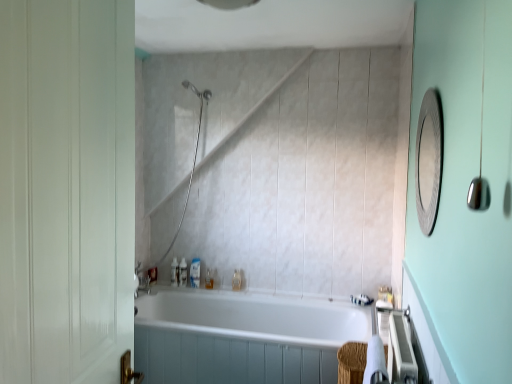
Question: Would you say translucent plastic bottle at lower left, arranged as the seventh toiletry when viewed from the right, is to the left or to the right of translucent plastic bottle at lower center, which is the sixth toiletry in left-to-right order, in the picture?

Choices:
 (A) right
 (B) left

Answer: (B)

Question: Based on their sizes in the image, would you say translucent plastic bottle at lower left, which is counted as the first toiletry, starting from the left, is bigger or smaller than translucent plastic bottle at lower center, which is the sixth toiletry in left-to-right order?

Choices:
 (A) small
 (B) big

Answer: (A)

Question: Considering the real-world distances, which object is closest to the metallic textured mirror at upper right?

Choices:
 (A) translucent plastic soap dispenser at center, the 4th toiletry positioned from the right
 (B) translucent plastic soap at lower right, acting as the seventh toiletry starting from the left
 (C) satin nickel showerhead at upper center
 (D) translucent plastic bottle at lower left, which is counted as the first toiletry, starting from the left
 (E) translucent plastic bottle at lower center, marked as the 3th toiletry in a left-to-right arrangement

Answer: (B)

Question: Which of these objects is positioned farthest from the white matte door at left?

Choices:
 (A) translucent plastic soap at lower center, acting as the 5th toiletry starting from the left
 (B) translucent plastic bottle at lower left, arranged as the seventh toiletry when viewed from the right
 (C) white glossy bathtub at center
 (D) translucent plastic soap at upper left, which is the sixth toiletry from right to left
 (E) satin nickel showerhead at upper center

Answer: (D)